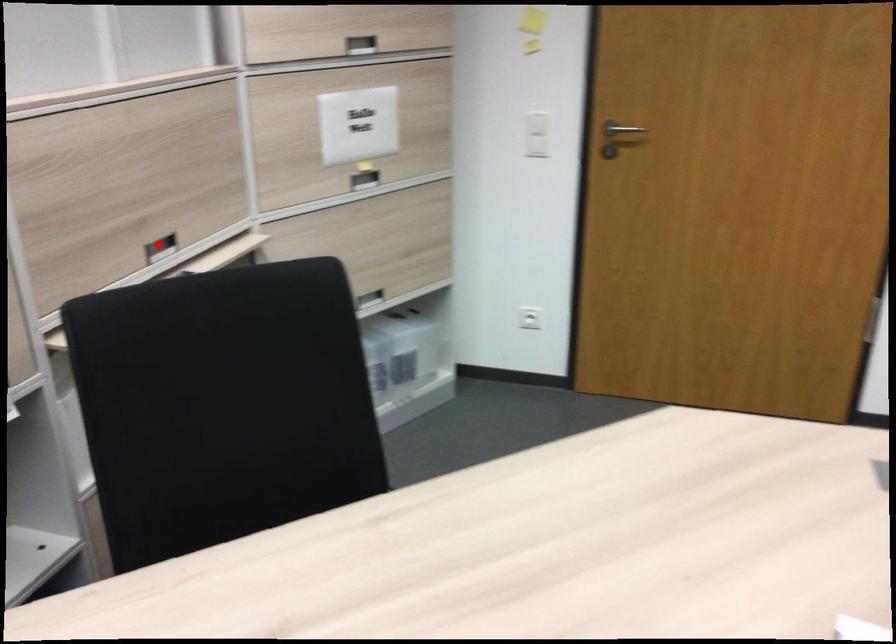
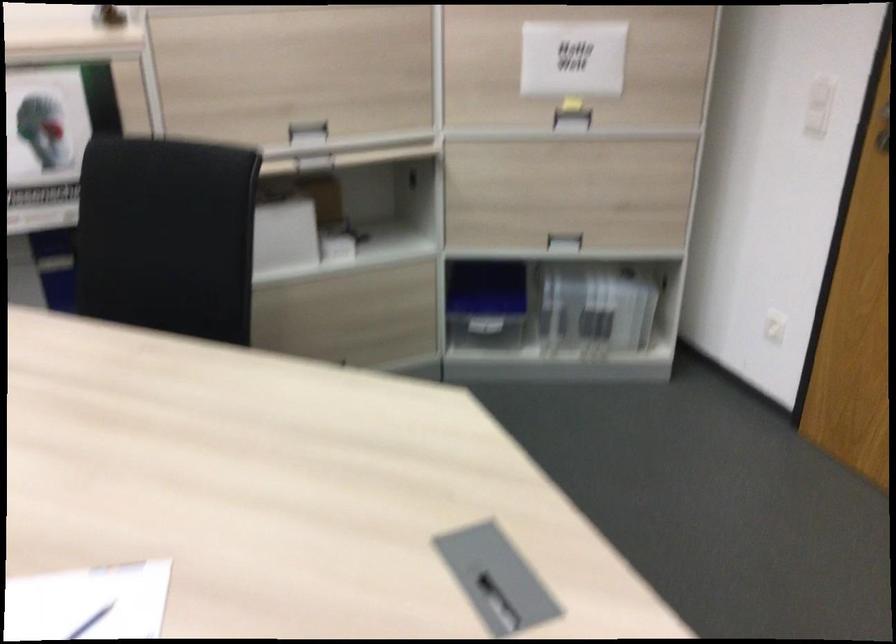
Locate, in the second image, the point that corresponds to the highlighted location in the first image.

(307, 129)